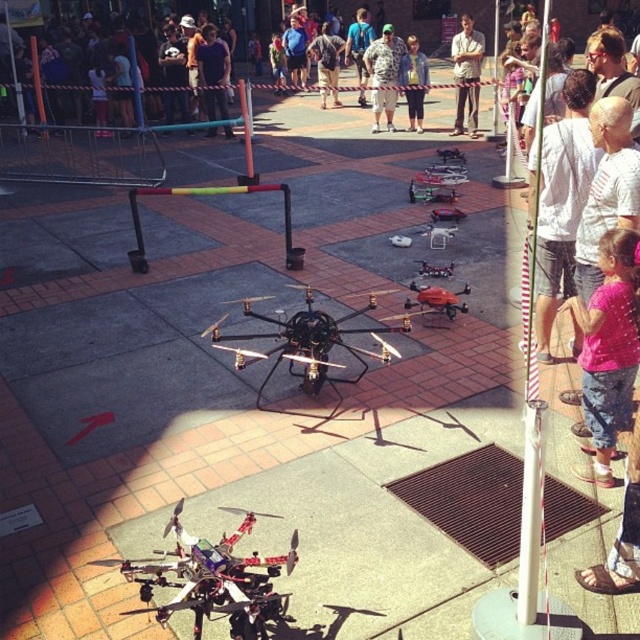
Which is behind, point (52, 45) or point (244, 339)?

The point (52, 45) is behind.

Does point (164, 54) come behind point (225, 337)?

Yes, point (164, 54) is farther from viewer.

Is point (56, 99) behind point (332, 346)?

Yes, it is behind point (332, 346).

The width and height of the screenshot is (640, 640). Identify the location of matte black clothing at upper center. (104, 76).

Can you confirm if pink fabric shirt at lower right is positioned to the left of denim jacket at center?

Correct, you'll find pink fabric shirt at lower right to the left of denim jacket at center.

Between point (637, 234) and point (412, 113), which one is positioned in front?

Positioned in front is point (637, 234).

You are a GUI agent. You are given a task and a screenshot of the screen. Output one action in this format:
    pyautogui.click(x=<x>, y=<y>)
    Task: Click on the pink fabric shirt at lower right
    The width and height of the screenshot is (640, 640).
    Given the screenshot: What is the action you would take?
    pyautogui.click(x=609, y=344)

Between point (461, 76) and point (205, 108), which one is positioned in front?

Positioned in front is point (461, 76).

From the picture: Can you confirm if light brown leather jacket at center is positioned above dark blue shirt at center?

Yes.

I want to click on light brown leather jacket at center, so click(467, 74).